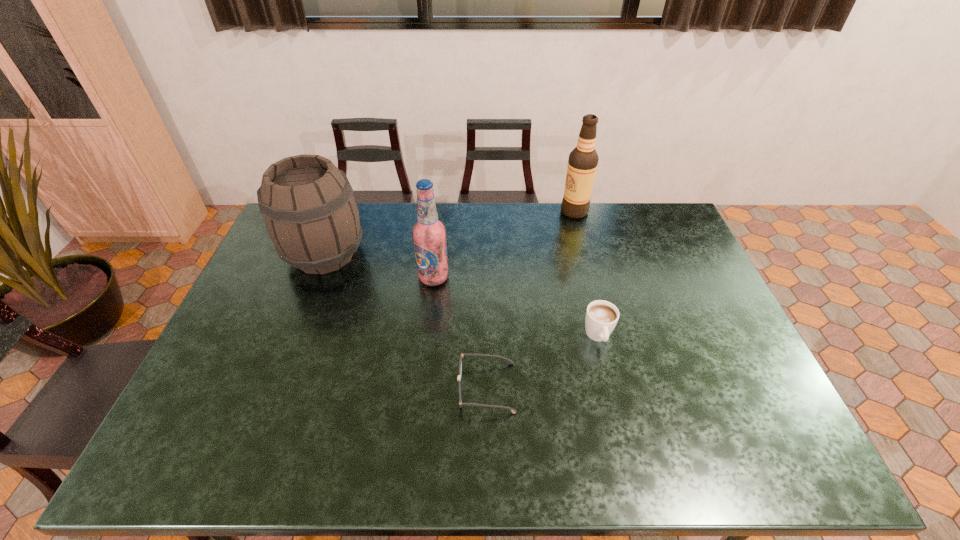
The height and width of the screenshot is (540, 960). Identify the location of vacant area that satisfies the following two spatial constraints: 1. on the front side of the nearer alcohol; 2. on the left side of the leftmost object. (316, 278).

Locate an element on the screen. vacant region that satisfies the following two spatial constraints: 1. with the handle on the side of the fourth tallest object; 2. on the face of the third object from right to left is located at coordinates (611, 388).

Locate an element on the screen. This screenshot has height=540, width=960. vacant space that satisfies the following two spatial constraints: 1. on the label of the farther alcohol; 2. with the handle on the side of the second shortest object is located at coordinates (607, 336).

Find the location of a particular element. vacant space that satisfies the following two spatial constraints: 1. on the label of the farther alcohol; 2. on the front side of the wine bucket is located at coordinates click(x=586, y=255).